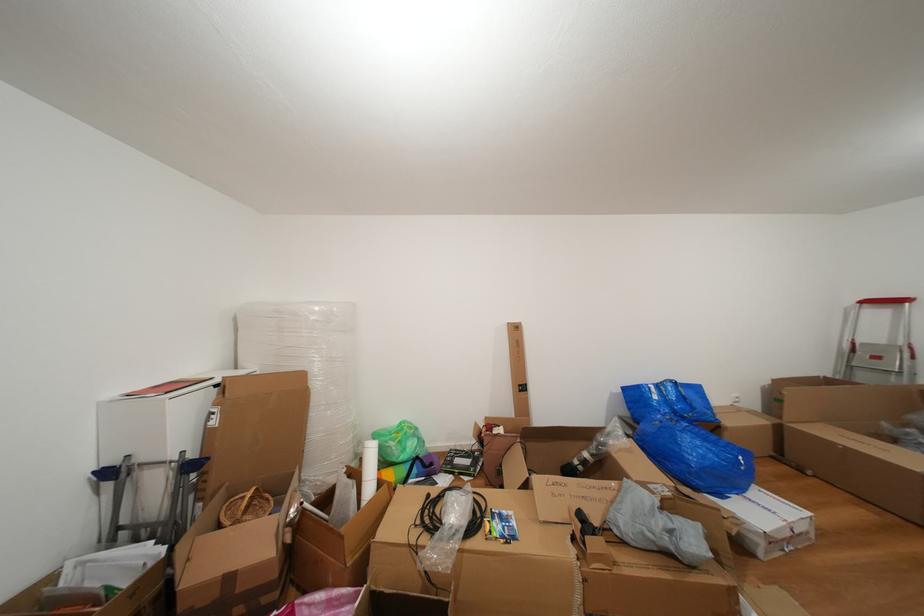
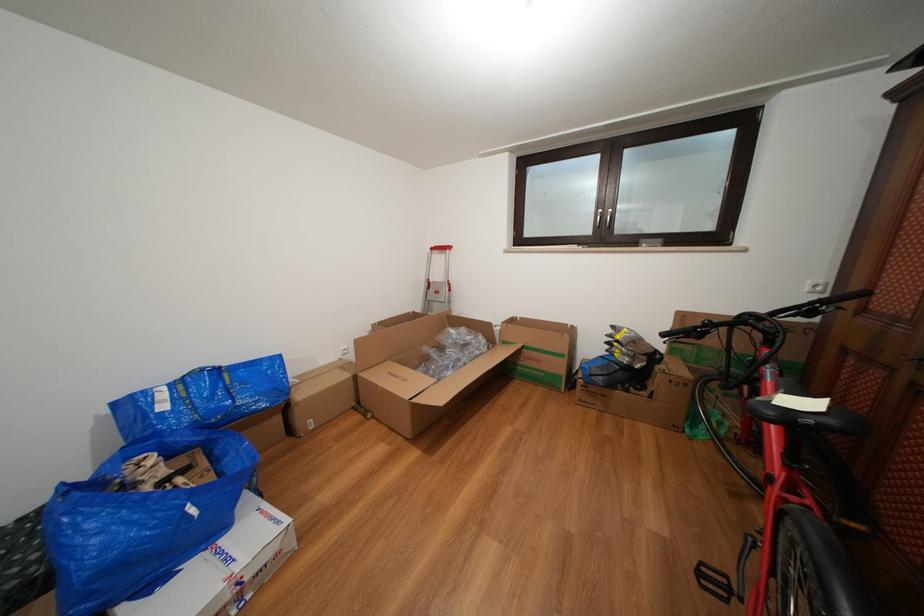
In the second image, find the point that corresponds to the point at 872,307 in the first image.

(441, 254)